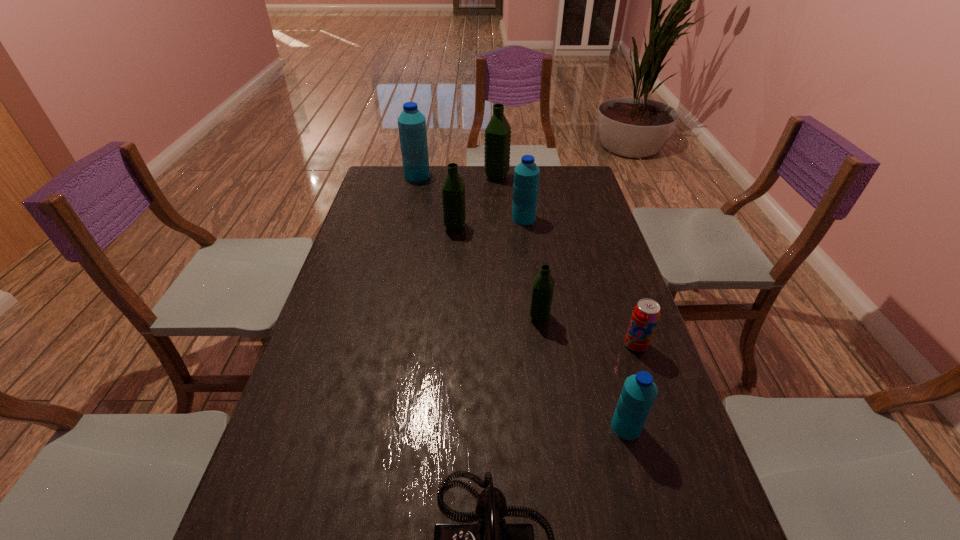
You are a GUI agent. You are given a task and a screenshot of the screen. Output one action in this format:
    pyautogui.click(x=<x>, y=<y>)
    Task: Click on the farthest green water bottle
    
    Given the screenshot: What is the action you would take?
    pyautogui.click(x=497, y=135)

Find the location of a particular element. Image resolution: width=960 pixels, height=540 pixels. the biggest green water bottle is located at coordinates (497, 135).

Where is `the biggest blue water bottle`? Image resolution: width=960 pixels, height=540 pixels. the biggest blue water bottle is located at coordinates (411, 123).

At what (x,y) coordinates should I click in order to perform the action: click on the leftmost object. Please return your answer as a coordinate pair (x, y). The image size is (960, 540). Looking at the image, I should click on (411, 123).

Locate an element on the screen. The width and height of the screenshot is (960, 540). the second farthest blue water bottle is located at coordinates (526, 174).

This screenshot has width=960, height=540. Identify the location of the second biggest blue water bottle. (526, 174).

The height and width of the screenshot is (540, 960). What are the coordinates of `the fifth water bottle from right to left` in the screenshot? It's located at (453, 190).

Locate an element on the screen. the leftmost green water bottle is located at coordinates (453, 190).

Locate an element on the screen. the fifth farthest water bottle is located at coordinates (542, 290).

You are a GUI agent. You are given a task and a screenshot of the screen. Output one action in this format:
    pyautogui.click(x=<x>, y=<y>)
    Task: Click on the rightmost green water bottle
    The image size is (960, 540).
    Given the screenshot: What is the action you would take?
    pyautogui.click(x=542, y=290)